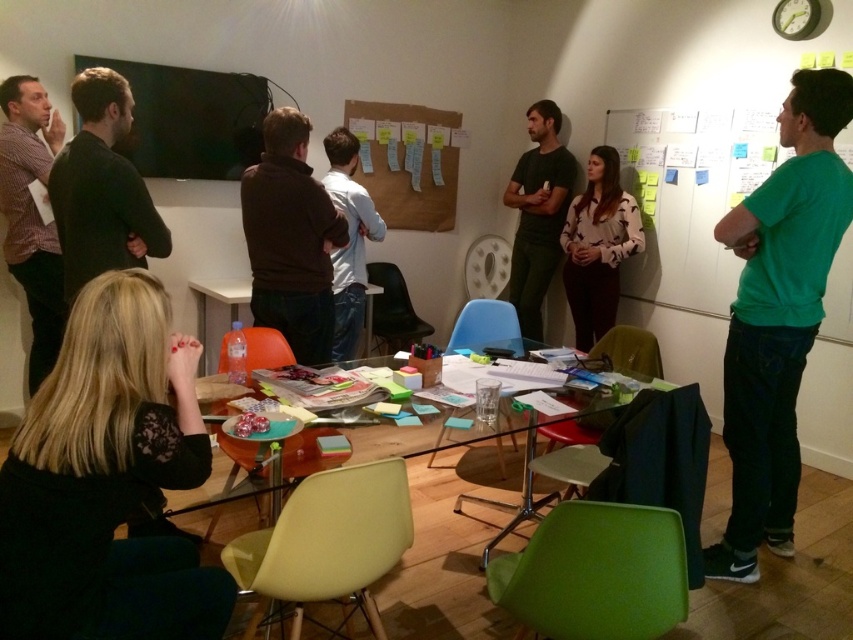
Does black sweater at left have a lesser height compared to plaid shirt at left?

Yes.

Can you confirm if black sweater at left is positioned to the left of plaid shirt at left?

No, black sweater at left is not to the left of plaid shirt at left.

Which is in front, point (113, 205) or point (13, 216)?

Positioned in front is point (113, 205).

Find the location of `black sweater at left`. black sweater at left is located at coordinates (102, 188).

Which is below, black sweater at left or white plastic table at center?

white plastic table at center

Locate an element on the screen. The image size is (853, 640). black sweater at left is located at coordinates (102, 188).

Does point (100, 173) come in front of point (241, 298)?

Yes, point (100, 173) is in front of point (241, 298).

Where is `black sweater at left`? black sweater at left is located at coordinates (102, 188).

Does black lace shirt at lower left have a larger size compared to white shirt at center?

Actually, black lace shirt at lower left might be smaller than white shirt at center.

Is point (195, 349) behind point (366, 198)?

No, it is not.

What are the coordinates of `black lace shirt at lower left` in the screenshot? It's located at (107, 481).